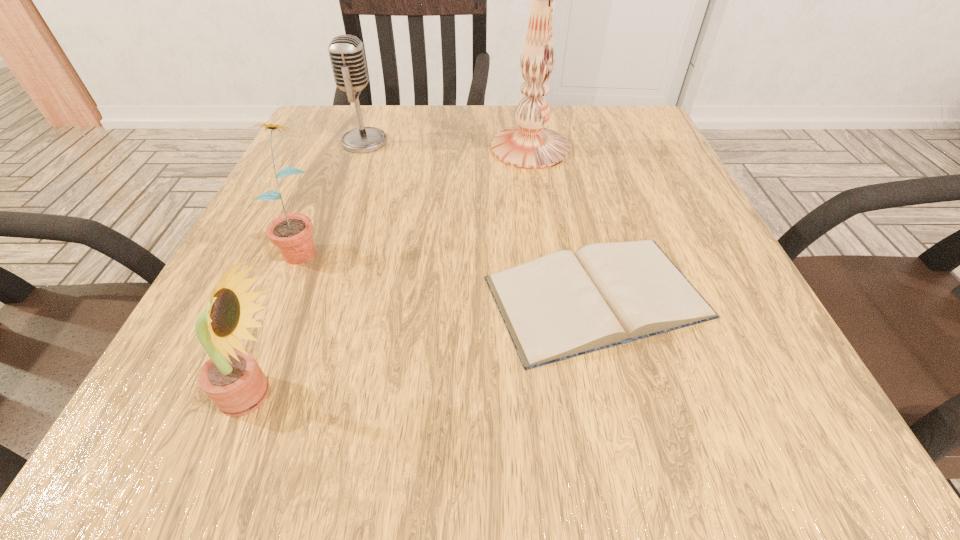
This screenshot has width=960, height=540. Find the location of `the tallest object`. the tallest object is located at coordinates (529, 145).

Image resolution: width=960 pixels, height=540 pixels. Find the location of `microphone`. microphone is located at coordinates (346, 52).

Find the location of a particular element. Image resolution: width=960 pixels, height=540 pixels. the farther sunflower is located at coordinates (292, 233).

Image resolution: width=960 pixels, height=540 pixels. Find the location of `the nearer sunflower`. the nearer sunflower is located at coordinates (232, 379).

Find the location of a particular element. The height and width of the screenshot is (540, 960). the shortest object is located at coordinates (561, 305).

Where is `blank area located 0.070m on the back of the lamp`? blank area located 0.070m on the back of the lamp is located at coordinates (523, 106).

Where is `free location located 0.070m on the front of the microphone`? free location located 0.070m on the front of the microphone is located at coordinates (353, 173).

Identify the location of free space located 0.170m on the flower of the farther sunflower. This screenshot has width=960, height=540. (252, 364).

Image resolution: width=960 pixels, height=540 pixels. I want to click on vacant space positioned 0.090m on the face of the nearer sunflower, so click(367, 394).

The width and height of the screenshot is (960, 540). I want to click on vacant space located 0.170m on the back of the Bible, so click(568, 181).